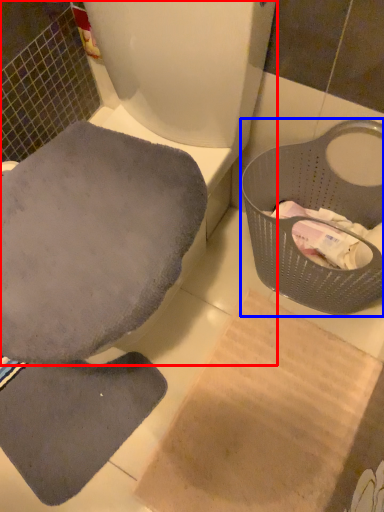
Question: Which of the following is the closest to the observer, toilet (highlighted by a red box) or basket container (highlighted by a blue box)?

Choices:
 (A) toilet
 (B) basket container

Answer: (A)